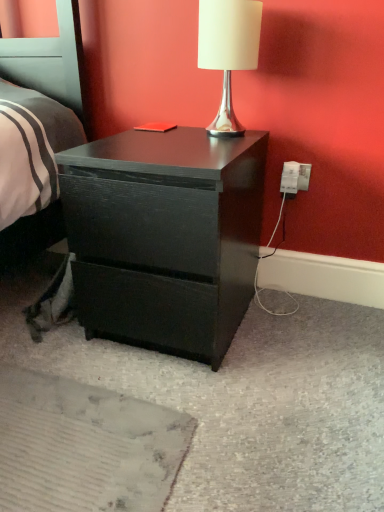
Locate an element on the screen. The height and width of the screenshot is (512, 384). vacant space underneath white glossy table lamp at upper center (from a real-world perspective) is located at coordinates (215, 132).